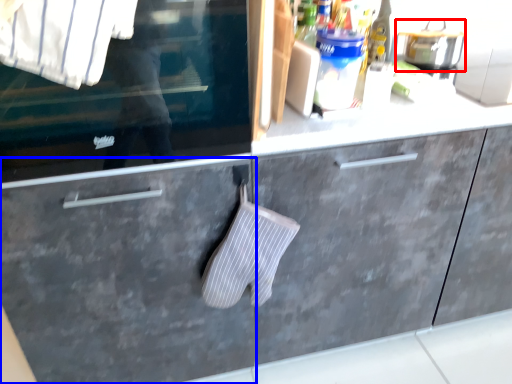
Question: Which object is closer to the camera taking this photo, appliance (highlighted by a red box) or drawer (highlighted by a blue box)?

Choices:
 (A) appliance
 (B) drawer

Answer: (B)